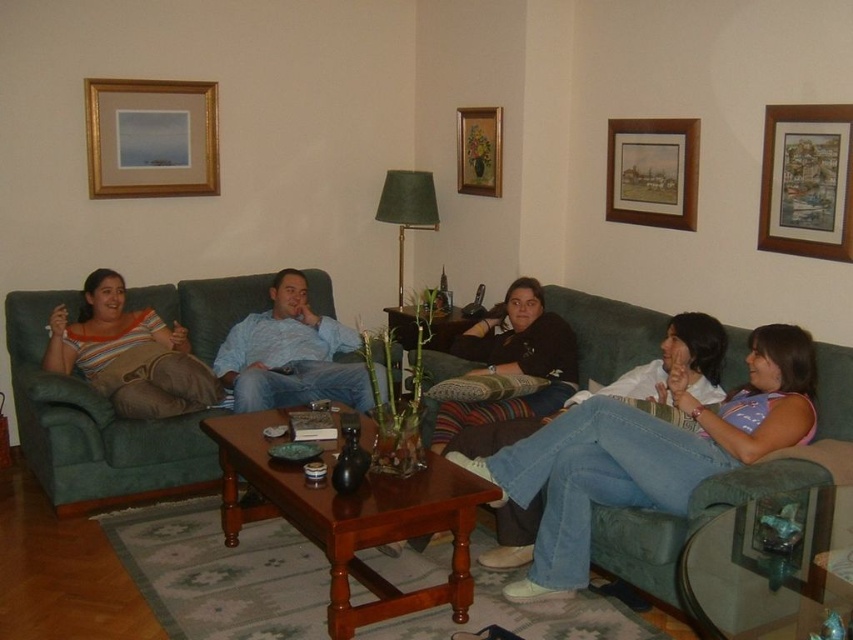
You are a delivery person who needs to place a package on the coffee table. The package is 3 feet long. The distance between the green fabric couch at center and the wooden picture frame at upper center is 7.36 feet. Can you safely place the package on the coffee table without it extending beyond the edges?

The distance between the green fabric couch at center and the wooden picture frame at upper center is 7.36 feet. Since the package is only 3 feet long, it will fit comfortably on the coffee table without extending beyond the edges.

You are a guest entering the living room and want to sit on the green fabric couch at center. Which direction should you walk relative to the wooden picture frame at upper center?

The green fabric couch at center is located below the wooden picture frame at upper center, so you should walk downward from the wooden picture frame at upper center to reach the green fabric couch at center.

You are a guest entering the living room and want to sit on the green fabric couch at center. To do so, you need to walk past the wooden framed artwork at upper right. Considering their heights, will you be able to walk under the artwork without ducking?

The green fabric couch at center is taller than wooden framed artwork at upper right. Since the artwork is shorter than the couch, it is likely positioned lower, so you should be able to walk under it without needing to duck.